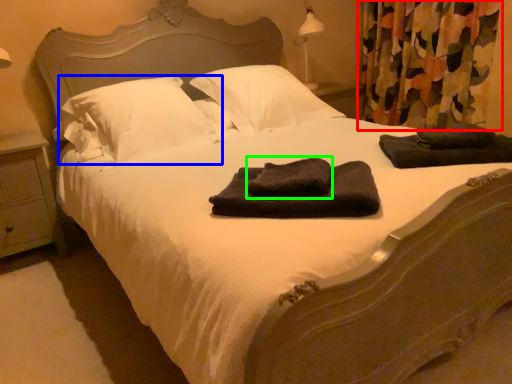
Question: Which object is the farthest from curtain (highlighted by a red box)? Choose among these: pillow (highlighted by a blue box) or bath towel (highlighted by a green box).

Choices:
 (A) pillow
 (B) bath towel

Answer: (B)